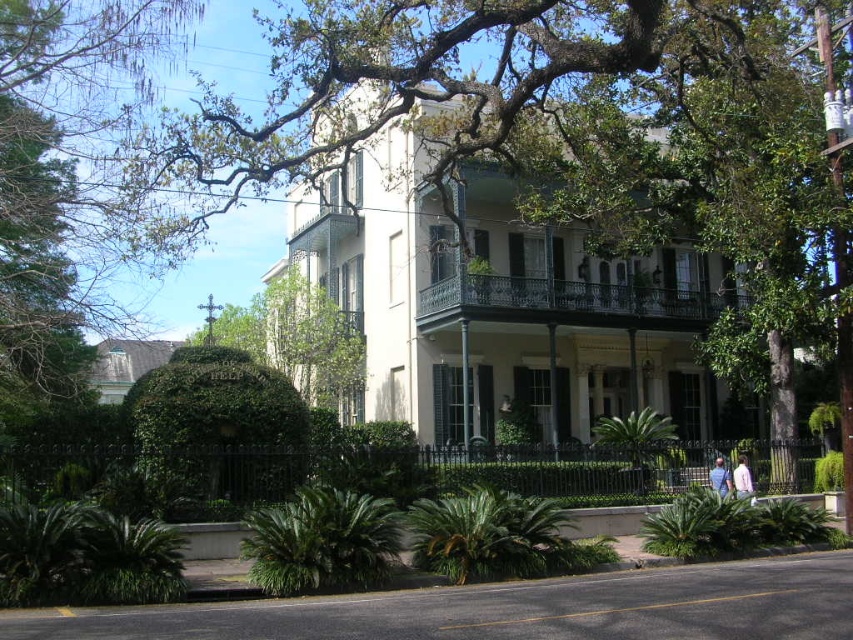
You are standing in front of the historic house and want to place a new bench between the green leafy tree at center and the blue denim jacket at lower right. Based on their positions, which object should the bench be closer to?

The bench should be closer to the blue denim jacket at lower right because the green leafy tree at center is closer to the viewer, meaning the blue denim jacket at lower right is farther away from the viewer. The bench placed between them should logically be closer to the farther object to maintain balance.

You are a visitor standing in front of the historic house and want to take a photo that includes both the green leafy tree at center and the dark green wrought iron porch at center. Which object will appear larger in the photo?

The green leafy tree at center will appear larger in the photo because it is much taller than the dark green wrought iron porch at center.

You are standing in front of the house and want to water the green leafy tree at center. Your water hose can reach up to 10 meters. Do you need to move closer to water it?

The green leafy tree at center is 10.92 meters away from the viewer, which is beyond the 10 meter reach of the hose. You will need to move closer to water it.